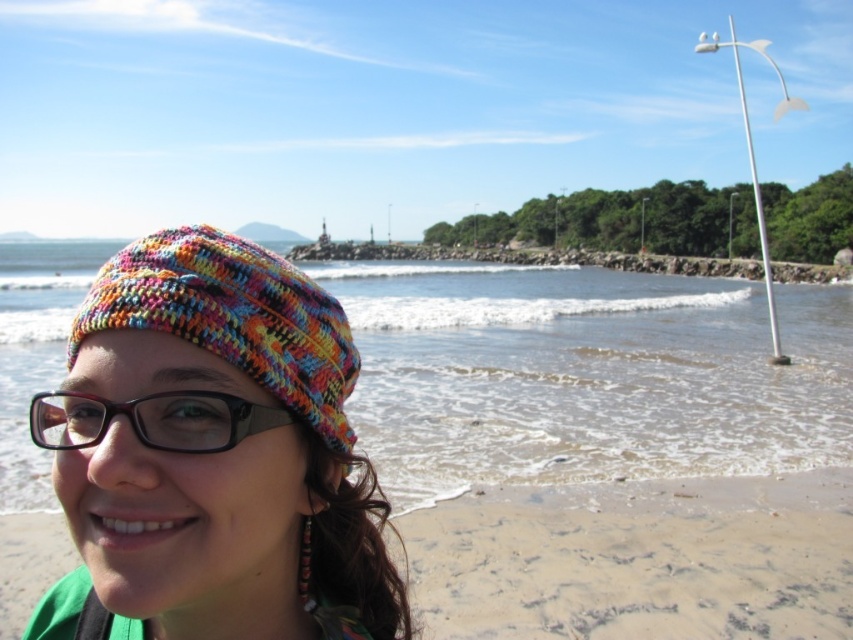
Is multicolored knitted hat at center wider than black plastic glasses at left?

Yes.

Between point (32, 432) and point (236, 440), which one is positioned in front?

Positioned in front is point (236, 440).

This screenshot has height=640, width=853. Describe the element at coordinates (213, 454) in the screenshot. I see `multicolored knitted hat at center` at that location.

Where is `multicolored knitted hat at center`? The height and width of the screenshot is (640, 853). multicolored knitted hat at center is located at coordinates (213, 454).

Is point (720, 465) positioned after point (215, 449)?

Yes, point (720, 465) is behind point (215, 449).

Can you confirm if clear water at lower left is bigger than black plastic glasses at left?

Indeed, clear water at lower left has a larger size compared to black plastic glasses at left.

Is point (566, 266) farther from camera compared to point (144, 408)?

Yes, it is.

The height and width of the screenshot is (640, 853). I want to click on clear water at lower left, so click(585, 374).

Does multicolored knitted hat at left have a smaller size compared to black plastic glasses at left?

No, multicolored knitted hat at left is not smaller than black plastic glasses at left.

Which is behind, point (206, 346) or point (244, 420)?

Positioned behind is point (244, 420).

Does point (276, 380) come behind point (170, 436)?

Yes, it is behind point (170, 436).

At what (x,y) coordinates should I click in order to perform the action: click on multicolored knitted hat at left. Please return your answer as a coordinate pair (x, y). This screenshot has height=640, width=853. Looking at the image, I should click on click(x=233, y=317).